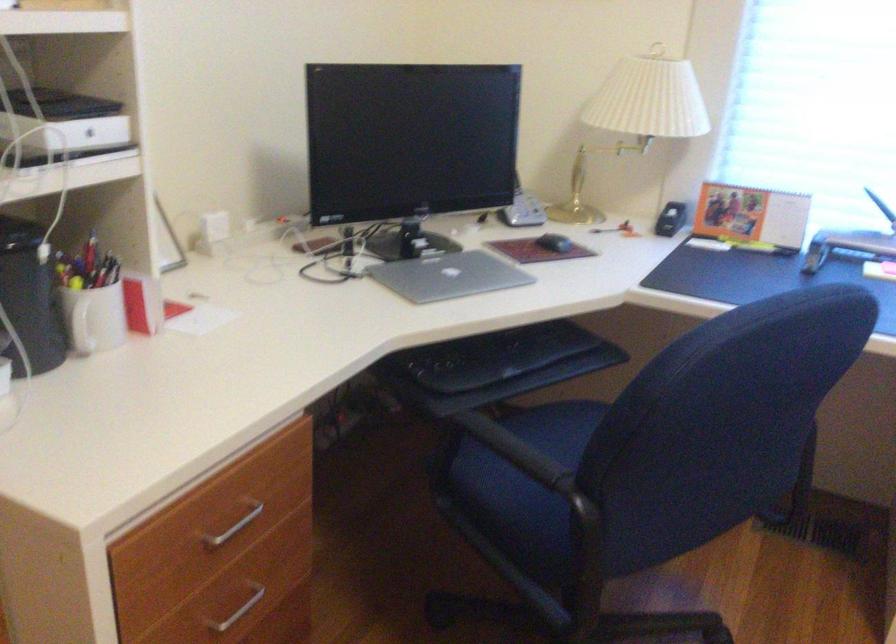
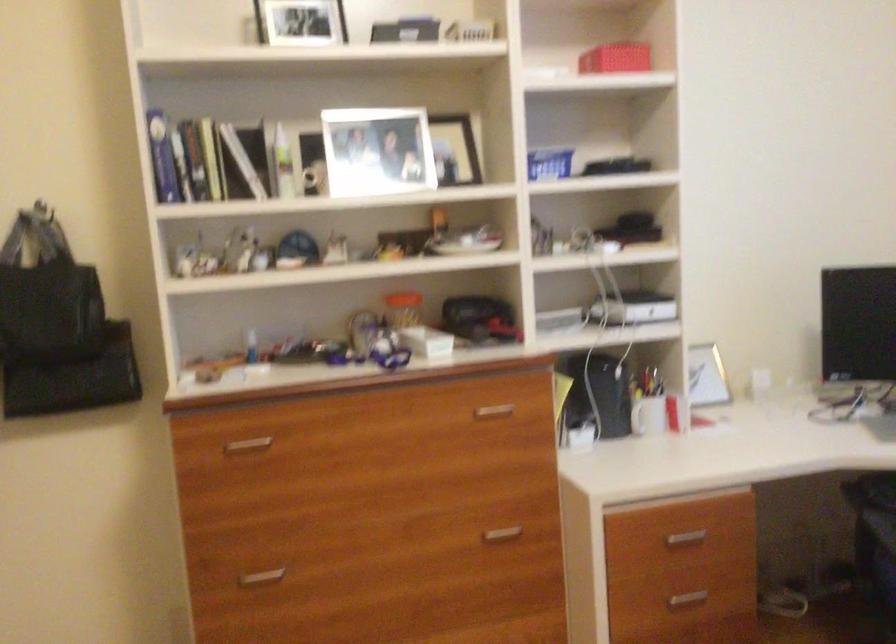
Question: The camera is either moving clockwise (left) or counter-clockwise (right) around the object. The first image is from the beginning of the video and the second image is from the end. Is the camera moving left or right when shooting the video?

Choices:
 (A) Left
 (B) Right

Answer: (B)